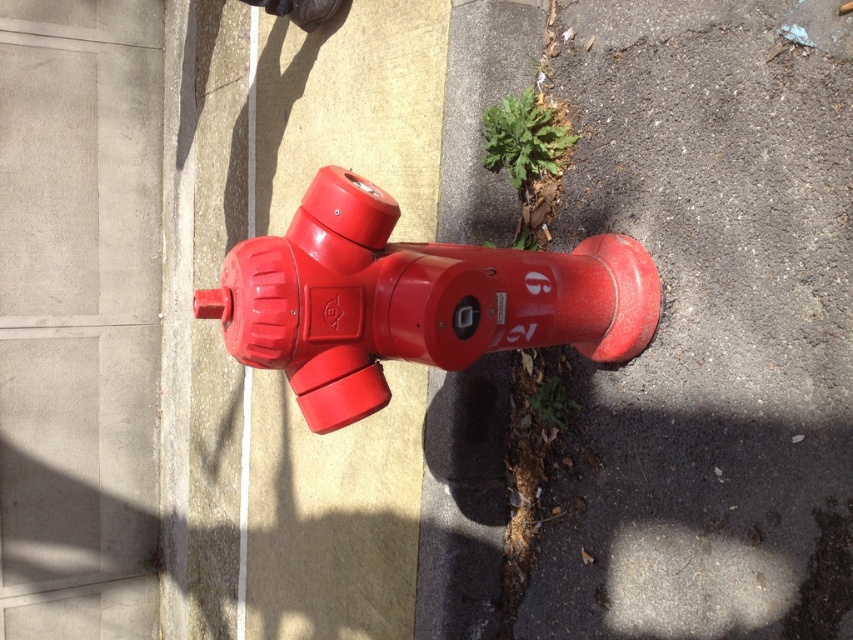
Question: Is glossy plastic hydrant at center closer to camera compared to green leafy plant at lower center?

Choices:
 (A) yes
 (B) no

Answer: (A)

Question: Estimate the real-world distances between objects in this image. Which object is closer to the green leafy plant at center?

Choices:
 (A) glossy plastic hydrant at center
 (B) smooth asphalt at lower right
 (C) green leafy plant at lower center

Answer: (B)

Question: Which object is closer to the camera taking this photo?

Choices:
 (A) green leafy plant at center
 (B) glossy plastic hydrant at center
 (C) smooth asphalt at lower right
 (D) green leafy plant at lower center

Answer: (B)

Question: Can you confirm if green leafy plant at center is wider than green leafy plant at lower center?

Choices:
 (A) no
 (B) yes

Answer: (B)

Question: Can you confirm if smooth asphalt at lower right is positioned above glossy plastic hydrant at center?

Choices:
 (A) yes
 (B) no

Answer: (B)

Question: Which of the following is the farthest from the observer?

Choices:
 (A) (630, 541)
 (B) (543, 410)
 (C) (323, 346)

Answer: (B)